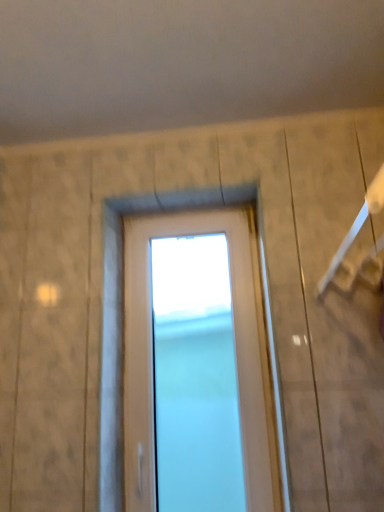
Measure the distance between point (x=240, y=446) and camera.

The distance of point (x=240, y=446) from camera is 1.22 meters.

This screenshot has width=384, height=512. Describe the element at coordinates (196, 366) in the screenshot. I see `white glossy door at center` at that location.

Identify the location of white glossy door at center. This screenshot has height=512, width=384. 196,366.

Find the location of a particular element. This screenshot has height=512, width=384. white glossy door at center is located at coordinates (196, 366).